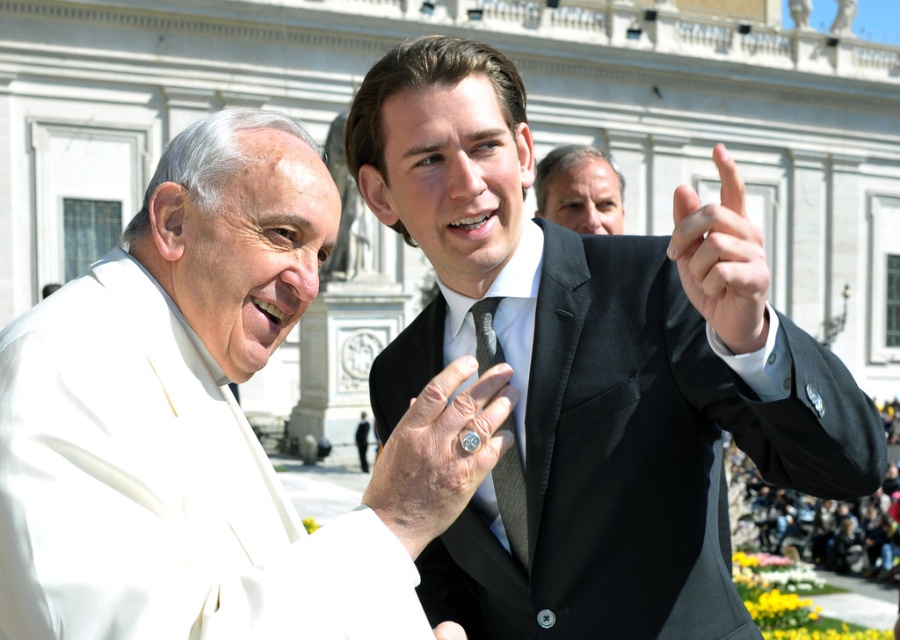
Does black satin suit at center appear under black silk hand at upper right?

Indeed, black satin suit at center is positioned under black silk hand at upper right.

Can you confirm if black satin suit at center is positioned above black silk hand at upper right?

No.

The height and width of the screenshot is (640, 900). Describe the element at coordinates (639, 458) in the screenshot. I see `black satin suit at center` at that location.

Image resolution: width=900 pixels, height=640 pixels. Find the location of `black satin suit at center`. black satin suit at center is located at coordinates (639, 458).

Which is below, white matte suit at left or smooth gray suit at upper center?

white matte suit at left

Is point (253, 637) more distant than point (596, 189)?

No.

I want to click on white matte suit at left, so click(207, 424).

Can you confirm if silver metallic ring at center is wider than smooth gray suit at upper center?

Incorrect, silver metallic ring at center's width does not surpass smooth gray suit at upper center's.

Between point (428, 465) and point (604, 214), which one is positioned behind?

The point (604, 214) is behind.

Find the location of a particular element. This screenshot has height=640, width=900. silver metallic ring at center is located at coordinates (439, 452).